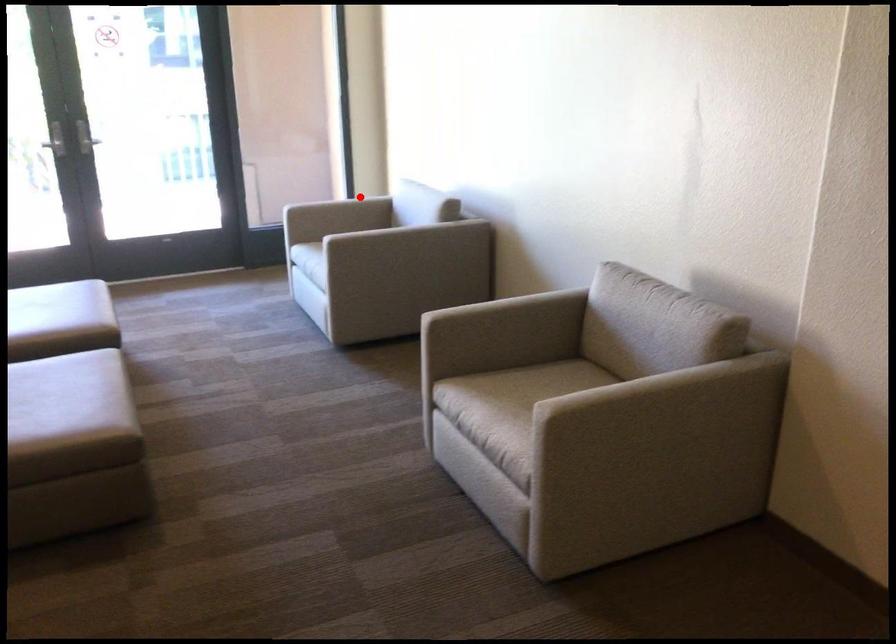
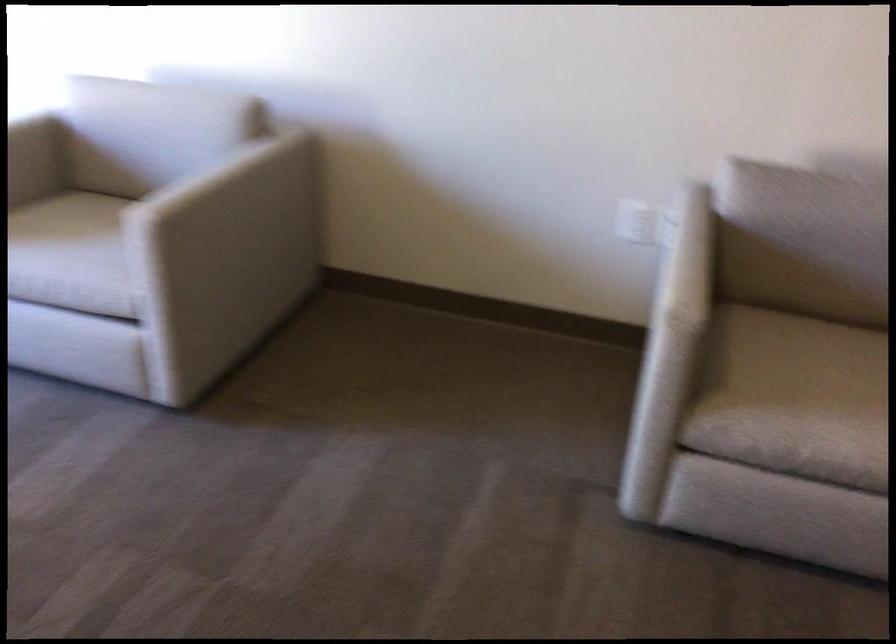
Locate, in the second image, the point that corresponds to the highlighted location in the first image.

(28, 124)